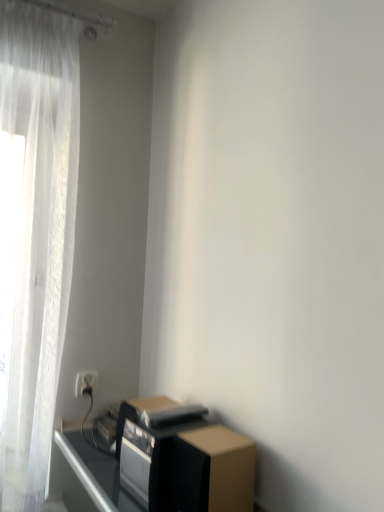
Question: Does brown cardboard box at lower right have a lesser width compared to black matte speaker at lower right?

Choices:
 (A) yes
 (B) no

Answer: (A)

Question: Is brown cardboard box at lower right looking in the opposite direction of black matte speaker at lower right?

Choices:
 (A) no
 (B) yes

Answer: (A)

Question: From the image's perspective, is brown cardboard box at lower right located beneath black matte speaker at lower right?

Choices:
 (A) no
 (B) yes

Answer: (A)

Question: Can we say brown cardboard box at lower right lies outside black matte speaker at lower right?

Choices:
 (A) no
 (B) yes

Answer: (B)

Question: Can you confirm if brown cardboard box at lower right is positioned to the right of black matte speaker at lower right?

Choices:
 (A) yes
 (B) no

Answer: (A)

Question: Does brown cardboard box at lower right have a greater width compared to black matte speaker at lower right?

Choices:
 (A) no
 (B) yes

Answer: (A)

Question: Can you confirm if white plastic electric outlet at lower left is bigger than black matte speaker at lower right?

Choices:
 (A) yes
 (B) no

Answer: (B)

Question: Is white plastic electric outlet at lower left further to camera compared to black matte speaker at lower right?

Choices:
 (A) no
 (B) yes

Answer: (B)

Question: From a real-world perspective, is white plastic electric outlet at lower left located beneath black matte speaker at lower right?

Choices:
 (A) yes
 (B) no

Answer: (B)

Question: From the image's perspective, is white plastic electric outlet at lower left above black matte speaker at lower right?

Choices:
 (A) yes
 (B) no

Answer: (A)

Question: From a real-world perspective, does white plastic electric outlet at lower left stand above black matte speaker at lower right?

Choices:
 (A) no
 (B) yes

Answer: (B)

Question: Is white plastic electric outlet at lower left to the left of black matte speaker at lower right from the viewer's perspective?

Choices:
 (A) yes
 (B) no

Answer: (A)

Question: Does black matte speaker at lower right turn towards brown cardboard box at lower right?

Choices:
 (A) yes
 (B) no

Answer: (B)